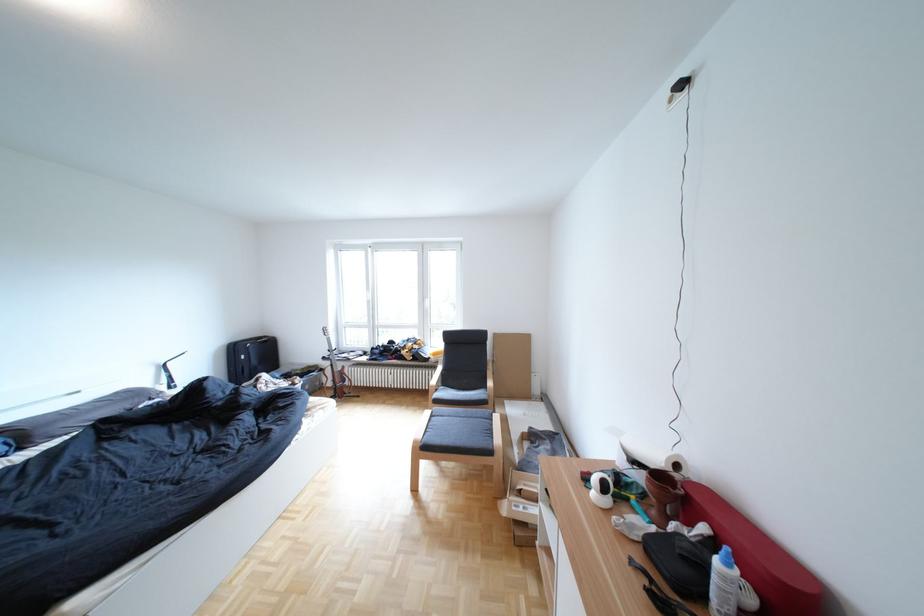
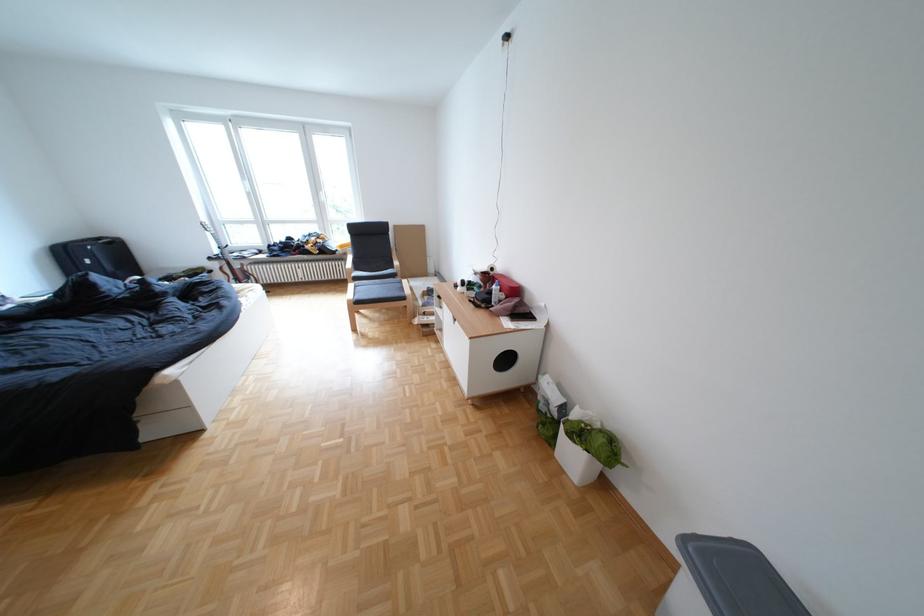
Find the pixel in the second image that matches point 443,414 in the first image.

(367, 286)